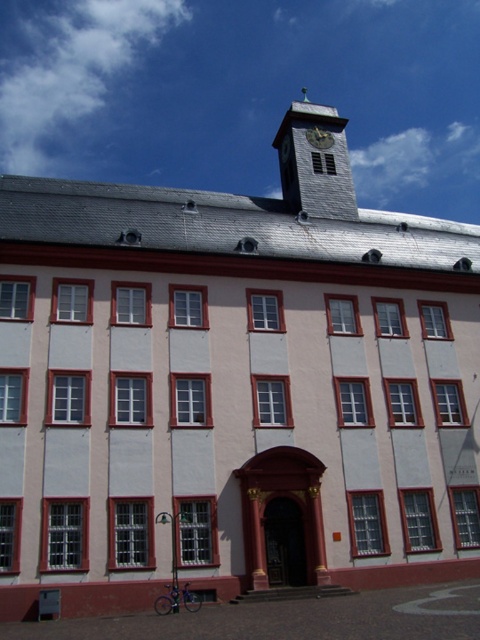
Question: Which point appears farthest from the camera in this image?

Choices:
 (A) (322, 131)
 (B) (310, 164)

Answer: (A)

Question: Can you confirm if gray stone clock tower at upper center is bigger than gold metallic clock at upper center?

Choices:
 (A) yes
 (B) no

Answer: (A)

Question: Among these objects, which one is nearest to the camera?

Choices:
 (A) gray stone clock tower at upper center
 (B) gold metallic clock at upper center

Answer: (A)

Question: Can you confirm if gray stone clock tower at upper center is wider than gold metallic clock at upper center?

Choices:
 (A) no
 (B) yes

Answer: (B)

Question: Is gray stone clock tower at upper center to the right of gold metallic clock at upper center from the viewer's perspective?

Choices:
 (A) yes
 (B) no

Answer: (A)